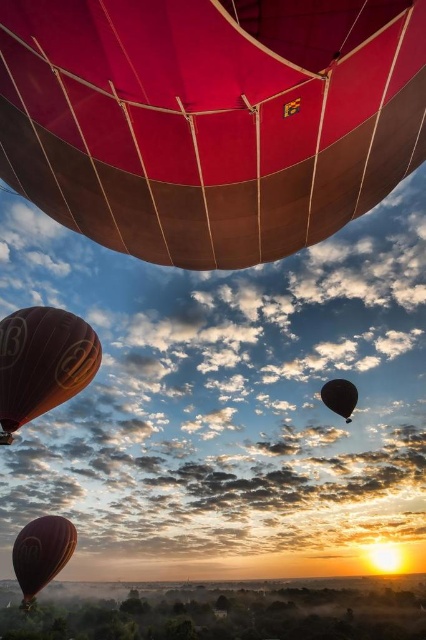
Question: Which point is closer to the camera?

Choices:
 (A) (40, 577)
 (B) (80, 381)
 (C) (331, 392)
 (D) (296, 134)

Answer: (D)

Question: Does matte orange balloon at lower left appear on the left side of black glossy balloon at lower right?

Choices:
 (A) no
 (B) yes

Answer: (B)

Question: Which point appears closest to the camera in this image?

Choices:
 (A) (340, 378)
 (B) (13, 365)
 (C) (28, 557)
 (D) (81, 145)

Answer: (D)

Question: Is matte orange balloon at lower left to the left of black glossy balloon at lower right from the viewer's perspective?

Choices:
 (A) yes
 (B) no

Answer: (A)

Question: Does matte red balloon at upper center lie in front of matte orange balloon at lower left?

Choices:
 (A) yes
 (B) no

Answer: (A)

Question: Which point appears farthest from the camera in this image?

Choices:
 (A) (49, 371)
 (B) (69, 540)
 (C) (196, 212)

Answer: (B)